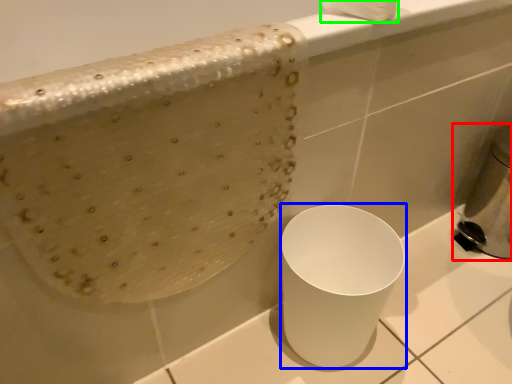
Question: Estimate the real-world distances between objects in this image. Which object is closer to appliance (highlighted by a red box), porcelain (highlighted by a blue box) or toilet paper (highlighted by a green box)?

Choices:
 (A) porcelain
 (B) toilet paper

Answer: (A)